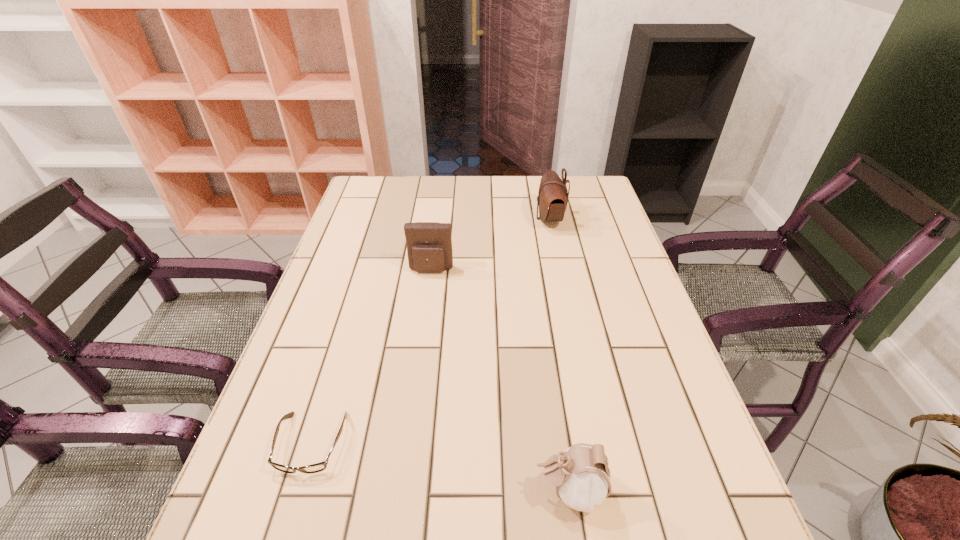
The width and height of the screenshot is (960, 540). Identify the location of vacant region located 0.160m on the front-facing side of the nearest pouch. (442, 490).

Locate an element on the screen. The height and width of the screenshot is (540, 960). vacant space located 0.080m on the front-facing side of the nearest pouch is located at coordinates (489, 490).

Where is `free region located on the front-facing side of the nearest pouch`? The height and width of the screenshot is (540, 960). free region located on the front-facing side of the nearest pouch is located at coordinates (360, 490).

At what (x,y) coordinates should I click in order to perform the action: click on vacant space situated 0.090m on the front-facing side of the leftmost object. Please return your answer as a coordinate pair (x, y). Image resolution: width=960 pixels, height=540 pixels. Looking at the image, I should click on (283, 534).

Find the location of a particular element. object situated at the far edge is located at coordinates (552, 198).

Find the location of `object that is positioned at the left edge`. object that is positioned at the left edge is located at coordinates (318, 467).

Find the location of a particular element. The image size is (960, 540). object located at the right edge is located at coordinates (552, 198).

Image resolution: width=960 pixels, height=540 pixels. I want to click on object that is positioned at the far right corner, so pos(552,198).

You are a GUI agent. You are given a task and a screenshot of the screen. Output one action in this format:
    pyautogui.click(x=<x>, y=<y>)
    Task: Click on the vacant region at the left edge of the desktop
    
    Given the screenshot: What is the action you would take?
    pyautogui.click(x=374, y=264)

The image size is (960, 540). In the image, there is a desktop. Identify the location of free space at the right edge. (578, 218).